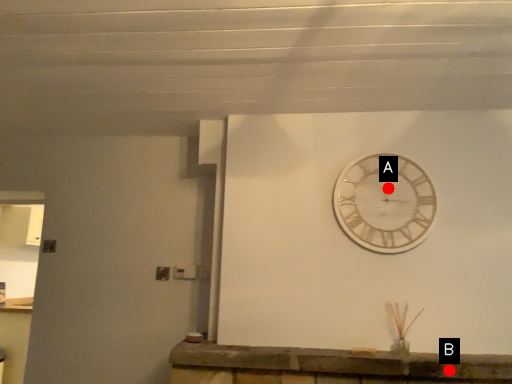
Question: Two points are circled on the image, labeled by A and B beside each circle. Which point is closer to the camera?

Choices:
 (A) A is closer
 (B) B is closer

Answer: (B)